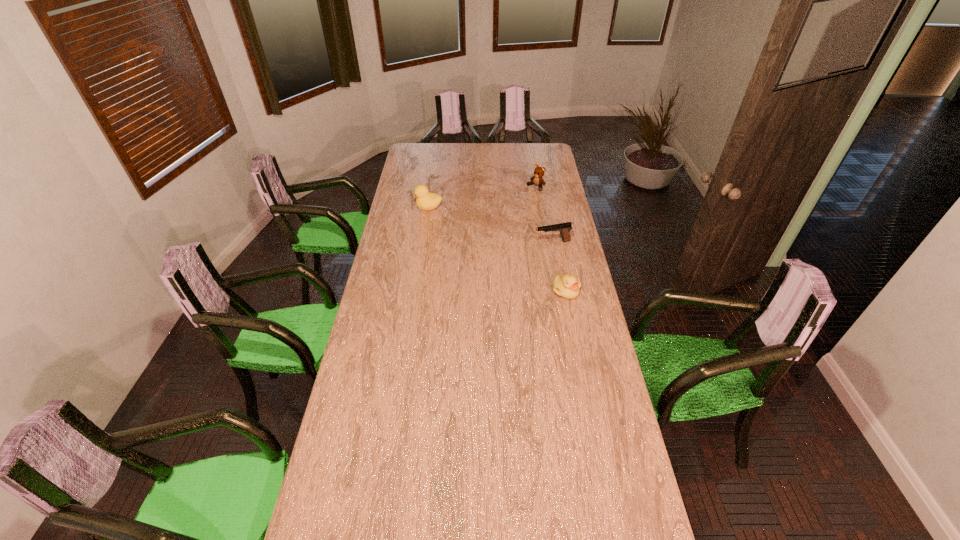
The width and height of the screenshot is (960, 540). Find the location of `free spot between the shortest object and the second nearest object`. free spot between the shortest object and the second nearest object is located at coordinates (560, 267).

Identify the location of vacant region between the second farthest object and the third farthest object. This screenshot has height=540, width=960. (491, 226).

In order to click on vacant area that lies between the duckling and the leftmost object in this screenshot , I will do `click(497, 249)`.

This screenshot has height=540, width=960. What are the coordinates of `object that stands as the third closest to the second farthest object` in the screenshot? It's located at (568, 286).

Identify which object is the second nearest to the teddy bear. Please provide its 2D coordinates. Your answer should be formatted as a tuple, i.e. [(x, y)], where the tuple contains the x and y coordinates of a point satisfying the conditions above.

[(425, 200)]